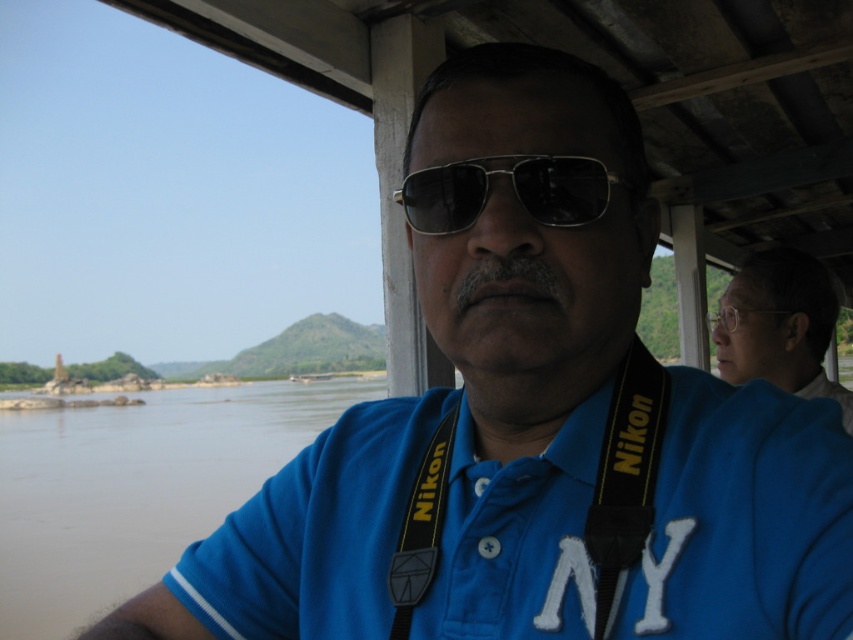
In the scene shown: Can you confirm if black fabric nikon strap at center is positioned below black nylon strap at center?

No.

Locate an element on the screen. The height and width of the screenshot is (640, 853). black fabric nikon strap at center is located at coordinates (625, 476).

What do you see at coordinates (625, 476) in the screenshot? This screenshot has width=853, height=640. I see `black fabric nikon strap at center` at bounding box center [625, 476].

Find the location of a particular element. The height and width of the screenshot is (640, 853). black fabric nikon strap at center is located at coordinates tap(625, 476).

Can you confirm if white matte glasses at upper right is thinner than metallic reflective sunglasses at center?

No, white matte glasses at upper right is not thinner than metallic reflective sunglasses at center.

Which is in front, point (805, 376) or point (564, 221)?

Point (564, 221)

Where is `white matte glasses at upper right`? The image size is (853, 640). white matte glasses at upper right is located at coordinates (779, 324).

Is brown muddy water at lower left taller than metallic reflective sunglasses at center?

Correct, brown muddy water at lower left is much taller as metallic reflective sunglasses at center.

Which is in front, point (0, 496) or point (451, 184)?

Point (451, 184) is more forward.

Identify the location of brown muddy water at lower left. The height and width of the screenshot is (640, 853). (136, 488).